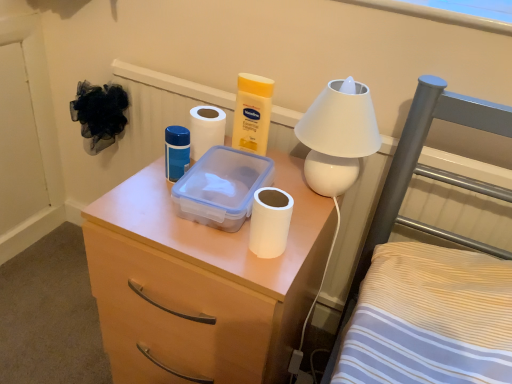
The height and width of the screenshot is (384, 512). I want to click on vacant region in front of transparent plastic storage box at center, so click(x=215, y=254).